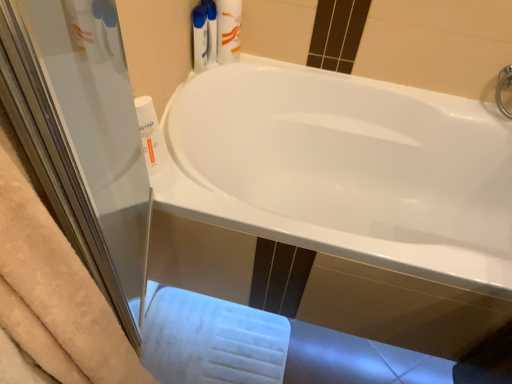
Find the location of a particular element. This screenshot has width=512, height=384. empty space that is to the right of white plastic bottle at left, the 2th cleaning product positioned from the right is located at coordinates (187, 187).